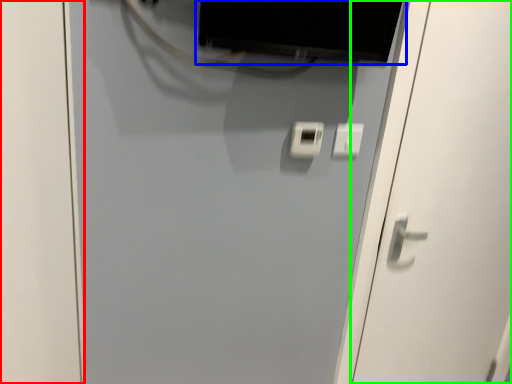
Question: Based on their relative distances, which object is nearer to door (highlighted by a red box)? Choose from computer monitor (highlighted by a blue box) and door (highlighted by a green box).

Choices:
 (A) computer monitor
 (B) door

Answer: (A)